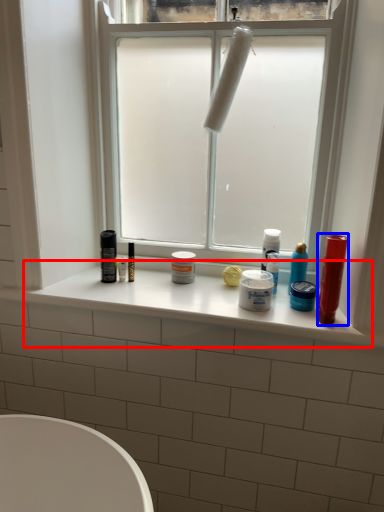
Question: Which object appears farthest to the camera in this image, window sill (highlighted by a red box) or lip balm (highlighted by a blue box)?

Choices:
 (A) window sill
 (B) lip balm

Answer: (A)